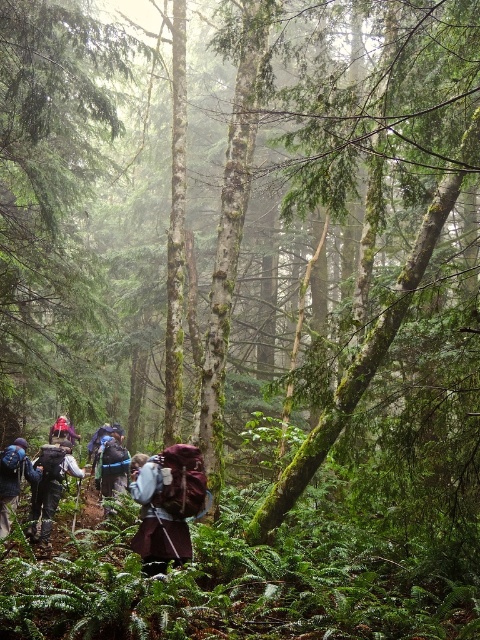
Can you confirm if maroon fabric backpack at center is bigger than dark gray backpack at lower left?

No, maroon fabric backpack at center is not bigger than dark gray backpack at lower left.

Is point (146, 499) farther from viewer compared to point (34, 538)?

That is False.

The height and width of the screenshot is (640, 480). What are the coordinates of `maroon fabric backpack at center` in the screenshot? It's located at (168, 506).

From the picture: Does dark gray backpack at lower left come behind camouflage fabric backpack at lower left?

That is False.

Who is taller, dark gray backpack at lower left or camouflage fabric backpack at lower left?

dark gray backpack at lower left is taller.

What are the coordinates of `dark gray backpack at lower left` in the screenshot? It's located at (49, 486).

Who is higher up, maroon fabric backpack at center or camouflage fabric backpack at lower left?

maroon fabric backpack at center is above.

Is maroon fabric backpack at center below camouflage fabric backpack at lower left?

Incorrect, maroon fabric backpack at center is not positioned below camouflage fabric backpack at lower left.

Identify the location of maroon fabric backpack at center. This screenshot has height=640, width=480. (168, 506).